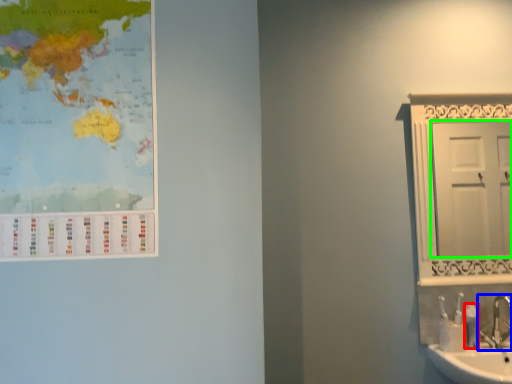
Question: Estimate the real-world distances between objects in this image. Which object is closer to toiletry (highlighted by a red box), tap (highlighted by a blue box) or door (highlighted by a green box)?

Choices:
 (A) tap
 (B) door

Answer: (A)